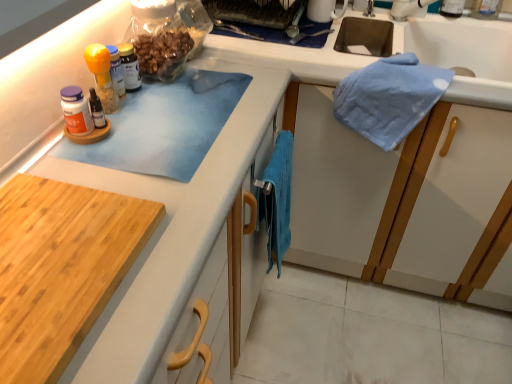
In order to face wooden cutting board at lower left, should I rotate leftwards or rightwards?

Turn left by 31.892 degrees to look at wooden cutting board at lower left.

What do you see at coordinates (458, 44) in the screenshot? Image resolution: width=512 pixels, height=384 pixels. I see `blue fabric towel at upper right` at bounding box center [458, 44].

The height and width of the screenshot is (384, 512). In order to click on translucent plastic bottle at center in this screenshot , I will do `click(130, 67)`.

From a real-world perspective, is translucent plastic bottle at center below wooden cutting board at lower left?

No, from a real-world perspective, translucent plastic bottle at center is not under wooden cutting board at lower left.

Considering the sizes of translucent plastic bottle at center and wooden cutting board at lower left in the image, is translucent plastic bottle at center wider or thinner than wooden cutting board at lower left?

Clearly, translucent plastic bottle at center has less width compared to wooden cutting board at lower left.

Visually, is translucent plastic bottle at center positioned to the left or to the right of wooden cutting board at lower left?

From the image, it's evident that translucent plastic bottle at center is to the right of wooden cutting board at lower left.

Is translucent plastic bottle at center in contact with wooden cutting board at lower left?

No, translucent plastic bottle at center is not making contact with wooden cutting board at lower left.

Is blue cotton towel at center inside the boundaries of wooden cutting board at lower left, or outside?

blue cotton towel at center is spatially situated outside wooden cutting board at lower left.

Which is further, (286, 236) or (75, 256)?

The point (286, 236) is more distant.

Is blue cotton towel at center beside wooden cutting board at lower left?

No, blue cotton towel at center is not beside wooden cutting board at lower left.

From a real-world perspective, between blue cotton towel at center and wooden cutting board at lower left, who is vertically lower?

In real-world perspective, blue cotton towel at center is lower.

From the image's perspective, between blue cotton towel at center and translucent plastic bottle at center, which one is located above?

translucent plastic bottle at center.

How different are the orientations of blue cotton towel at center and translucent plastic bottle at center in degrees?

0.00472 degrees separate the facing orientations of blue cotton towel at center and translucent plastic bottle at center.

From a real-world perspective, which is physically above, blue cotton towel at center or translucent plastic bottle at center?

From a 3D spatial view, translucent plastic bottle at center is above.

Is blue cotton towel at center facing away from translucent plastic bottle at center?

Yes, blue cotton towel at center is positioned with its back facing translucent plastic bottle at center.

Is blue cotton towel at center inside translucent plastic bottle at center?

No, blue cotton towel at center is not a part of translucent plastic bottle at center.

I want to click on bottle that is behind the blue cotton towel at center, so click(x=130, y=67).

Is the position of translucent plastic bottle at center more distant than that of blue cotton towel at center?

Yes, translucent plastic bottle at center is further from the camera.

Does point (137, 66) lie behind point (282, 204)?

No, (137, 66) is closer to viewer.

Is blue fabric towel at upper right thinner than blue cotton towel at center?

No.

From the image's perspective, which one is positioned higher, blue fabric towel at upper right or blue cotton towel at center?

blue fabric towel at upper right, from the image's perspective.

From the picture: Considering the relative positions of blue fabric towel at upper right and blue cotton towel at center in the image provided, is blue fabric towel at upper right to the left or to the right of blue cotton towel at center?

In the image, blue fabric towel at upper right appears on the right side of blue cotton towel at center.

Measure the distance between translucent plastic bottle at center and blue fabric towel at upper right.

A distance of 1.04 meters exists between translucent plastic bottle at center and blue fabric towel at upper right.

Is translucent plastic bottle at center oriented towards blue fabric towel at upper right?

No.

How many degrees apart are the facing directions of translucent plastic bottle at center and blue fabric towel at upper right?

89.5 degrees.

Based on the photo, considering the positions of objects translucent plastic bottle at center and blue fabric towel at upper right in the image provided, who is more to the right, translucent plastic bottle at center or blue fabric towel at upper right?

Positioned to the right is blue fabric towel at upper right.

Relative to blue fabric towel at upper right, is blue cotton towel at center in front or behind?

In the image, blue cotton towel at center appears in front of blue fabric towel at upper right.

Are blue cotton towel at center and blue fabric towel at upper right far apart?

blue cotton towel at center is near blue fabric towel at upper right, not far away.

From a real-world perspective, who is located higher, blue cotton towel at center or blue fabric towel at upper right?

In real-world perspective, blue fabric towel at upper right is above.

Considering the sizes of objects blue cotton towel at center and blue fabric towel at upper right in the image provided, who is wider, blue cotton towel at center or blue fabric towel at upper right?

blue fabric towel at upper right is wider.

Image resolution: width=512 pixels, height=384 pixels. Find the location of `bottle lying on the right of wooden cutting board at lower left`. bottle lying on the right of wooden cutting board at lower left is located at coordinates (130, 67).

In order to click on cabinetry above the blue cotton towel at center (from a real-world perspective) in this screenshot , I will do `click(61, 268)`.

From the image, which object appears to be nearer to blue fabric towel at upper right, wooden cutting board at lower left or blue cotton towel at center?

Based on the image, blue cotton towel at center appears to be nearer to blue fabric towel at upper right.

Estimate the real-world distances between objects in this image. Which object is closer to blue cotton towel at center, blue fabric towel at upper right or wooden cutting board at lower left?

wooden cutting board at lower left.

Based on their spatial positions, is blue cotton towel at center or blue fabric towel at upper right further from wooden cutting board at lower left?

blue fabric towel at upper right.

Based on their spatial positions, is wooden cutting board at lower left or blue fabric towel at upper right further from blue cotton towel at center?

Based on the image, blue fabric towel at upper right appears to be further to blue cotton towel at center.

Estimate the real-world distances between objects in this image. Which object is further from wooden cutting board at lower left, blue cotton towel at center or translucent plastic bottle at center?

Based on the image, translucent plastic bottle at center appears to be further to wooden cutting board at lower left.

Considering their positions, is wooden cutting board at lower left positioned further to blue fabric towel at upper right than translucent plastic bottle at center?

wooden cutting board at lower left lies further to blue fabric towel at upper right than the other object.

Consider the image. Which object lies further to the anchor point blue fabric towel at upper right, translucent plastic bottle at center or blue cotton towel at center?

translucent plastic bottle at center.

From the image, which object appears to be nearer to blue fabric towel at upper right, translucent plastic bottle at center or wooden cutting board at lower left?

Among the two, translucent plastic bottle at center is located nearer to blue fabric towel at upper right.

Identify the location of bottle between wooden cutting board at lower left and blue fabric towel at upper right in the horizontal direction. This screenshot has height=384, width=512. (130, 67).

The image size is (512, 384). I want to click on bath towel located between wooden cutting board at lower left and translucent plastic bottle at center in the depth direction, so click(x=277, y=199).

Where is `bath towel situated between wooden cutting board at lower left and blue fabric towel at upper right from left to right`? Image resolution: width=512 pixels, height=384 pixels. bath towel situated between wooden cutting board at lower left and blue fabric towel at upper right from left to right is located at coordinates (277, 199).

The height and width of the screenshot is (384, 512). What are the coordinates of `bath towel situated between translucent plastic bottle at center and blue fabric towel at upper right from left to right` in the screenshot? It's located at (277, 199).